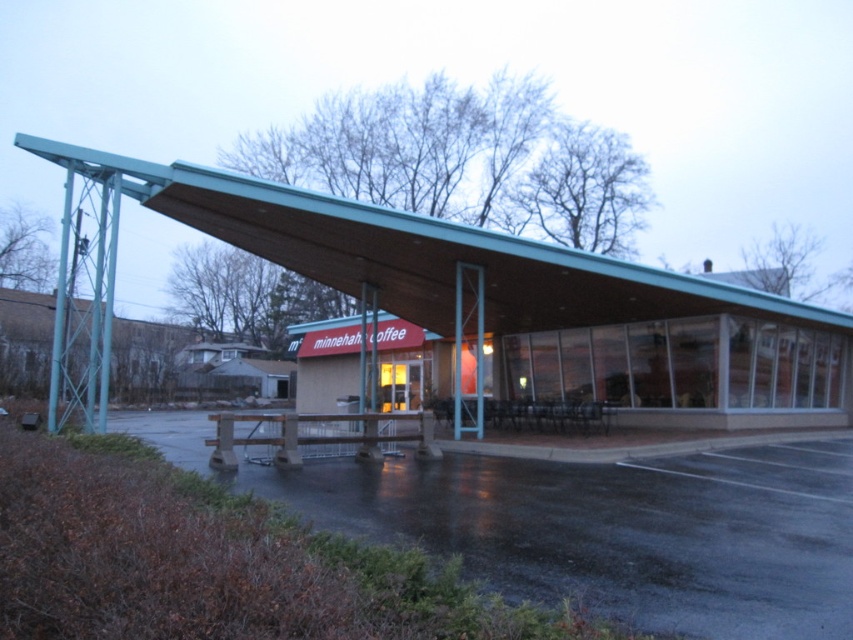
You are a customer arriving at Minnehaha Coffee and need to park your car. The parking lot has spaces on the dark asphalt parking lot at lower left. Can you drive your car directly to the teal wood shelter at center without going around the building?

The dark asphalt parking lot at lower left is in front of teal wood shelter at center, so you can drive directly from the dark asphalt parking lot at lower left to the teal wood shelter at center without needing to go around the building.

You are standing at the entrance of Minnehaha Coffee and want to walk to the dark asphalt parking lot at lower left. What direction should you head?

The dark asphalt parking lot at lower left is located at point (616, 529), so you should head towards the lower left direction from the entrance.